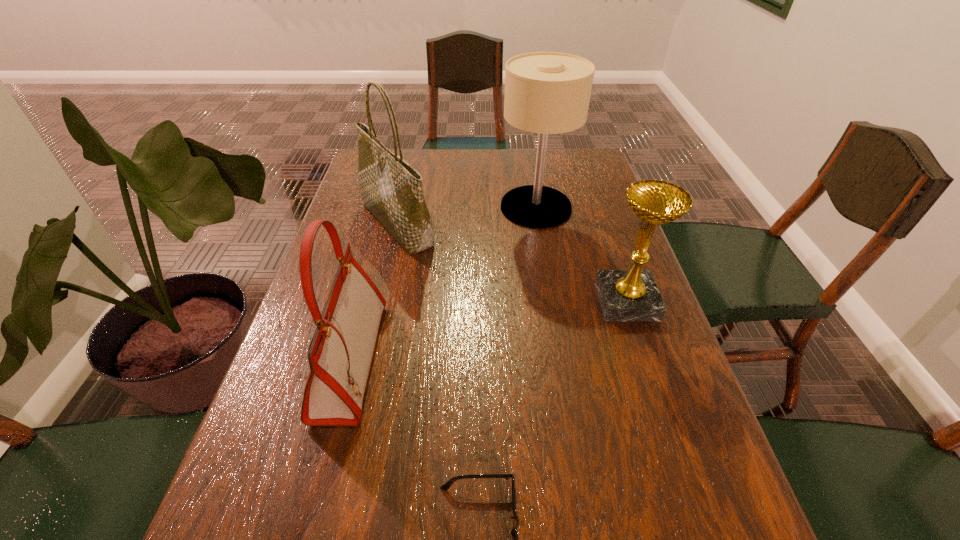
Locate an element on the screen. table lamp is located at coordinates (545, 92).

Locate an element on the screen. This screenshot has height=540, width=960. shopping bag is located at coordinates point(391,189).

You are a GUI agent. You are given a task and a screenshot of the screen. Output one action in this format:
    pyautogui.click(x=<x>, y=<y>)
    Task: Click on the handbag
    This screenshot has width=960, height=540.
    Given the screenshot: What is the action you would take?
    pyautogui.click(x=340, y=353)

This screenshot has width=960, height=540. Identify the location of the second shortest object. (625, 295).

At what (x,y) coordinates should I click in order to perform the action: click on award. Please return your answer as a coordinate pair (x, y). The height and width of the screenshot is (540, 960). Looking at the image, I should click on (625, 295).

The width and height of the screenshot is (960, 540). In order to click on free region located on the front of the second object from right to left in this screenshot , I will do `click(541, 244)`.

The image size is (960, 540). Find the location of `free region located 0.100m on the back of the shopping bag`. free region located 0.100m on the back of the shopping bag is located at coordinates (407, 180).

The width and height of the screenshot is (960, 540). Identify the location of free space located on the right of the handbag. (523, 360).

Locate an element on the screen. The width and height of the screenshot is (960, 540). free space located 0.400m on the front-facing side of the rightmost object is located at coordinates coord(433,301).

The width and height of the screenshot is (960, 540). What are the coordinates of `vacant space located 0.350m on the front-facing side of the rightmost object` in the screenshot? It's located at (453, 301).